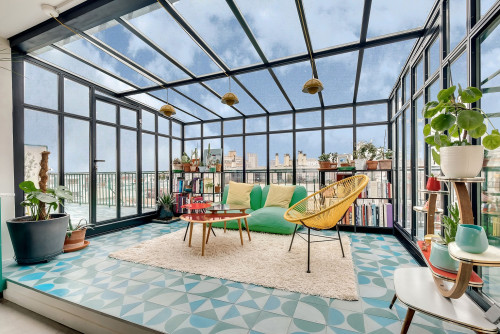
At what (x,y) coordinates should I click in order to perform the action: click on potted plant. Please return your answer as a coordinate pair (x, y). The height and width of the screenshot is (334, 500). Looking at the image, I should click on (42, 223), (461, 137), (360, 161), (373, 161), (385, 163), (328, 161), (334, 164), (344, 164).